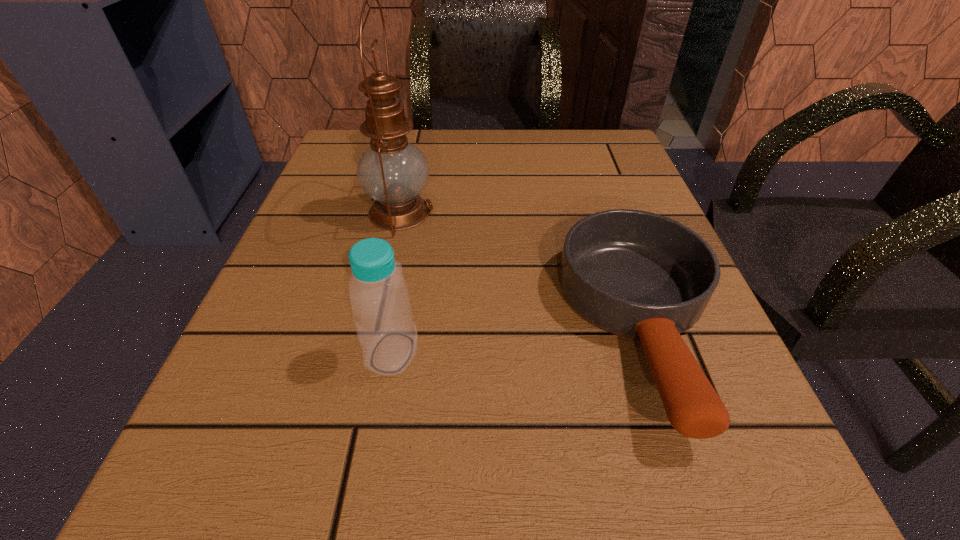
Locate an element on the screen. the farthest object is located at coordinates (392, 171).

Identify the location of the tallest object. (392, 171).

Find the location of a particular element. The image size is (960, 540). bottle is located at coordinates (379, 295).

Identify the location of the shortest object. The image size is (960, 540). (636, 274).

Locate an element on the screen. pan is located at coordinates (636, 274).

Locate an element on the screen. The image size is (960, 540). free space located on the right of the farthest object is located at coordinates (584, 212).

Locate an element on the screen. vacant area situated on the back of the bottle is located at coordinates (406, 276).

I want to click on object that is at the near edge, so pos(636,274).

The height and width of the screenshot is (540, 960). Identify the location of object at the left edge. (392, 171).

The width and height of the screenshot is (960, 540). What are the coordinates of `object at the right edge` in the screenshot? It's located at (636, 274).